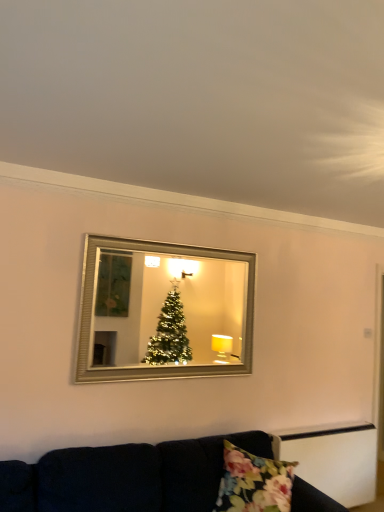
Question: Considering the positions of silver/glass mirror at upper center and velvet dark blue couch at lower center in the image, is silver/glass mirror at upper center taller or shorter than velvet dark blue couch at lower center?

Choices:
 (A) tall
 (B) short

Answer: (A)

Question: From a real-world perspective, is silver/glass mirror at upper center positioned above or below velvet dark blue couch at lower center?

Choices:
 (A) above
 (B) below

Answer: (A)

Question: Which of these objects is positioned closest to the silver/glass mirror at upper center?

Choices:
 (A) floral fabric pillow at lower center
 (B) velvet dark blue couch at lower center

Answer: (B)

Question: Which object is the closest to the floral fabric pillow at lower center?

Choices:
 (A) silver/glass mirror at upper center
 (B) velvet dark blue couch at lower center

Answer: (B)